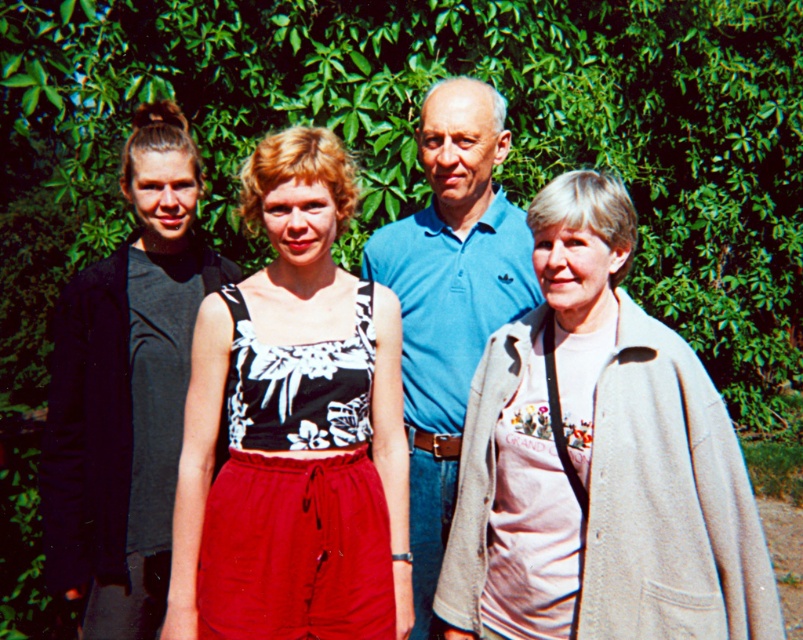
Who is positioned more to the left, light beige woolen coat at center or blue cotton polo shirt at center?

blue cotton polo shirt at center is more to the left.

Is point (610, 228) positioned after point (488, 225)?

That is False.

You are a GUI agent. You are given a task and a screenshot of the screen. Output one action in this format:
    pyautogui.click(x=<x>, y=<y>)
    Task: Click on the light beige woolen coat at center
    The width and height of the screenshot is (803, 640).
    Given the screenshot: What is the action you would take?
    pyautogui.click(x=598, y=460)

Is black floral tank top at center to the left of blue cotton polo shirt at center from the viewer's perspective?

Correct, you'll find black floral tank top at center to the left of blue cotton polo shirt at center.

Between point (210, 433) and point (492, 157), which one is positioned behind?

The point (492, 157) is more distant.

The height and width of the screenshot is (640, 803). What are the coordinates of `black floral tank top at center` in the screenshot? It's located at (296, 420).

The height and width of the screenshot is (640, 803). What do you see at coordinates (296, 420) in the screenshot?
I see `black floral tank top at center` at bounding box center [296, 420].

Is black floral tank top at center below black matte tank top at left?

Yes.

Is point (343, 454) positioned behind point (55, 468)?

No, (343, 454) is in front of (55, 468).

Locate an element on the screen. This screenshot has width=803, height=640. black floral tank top at center is located at coordinates (296, 420).